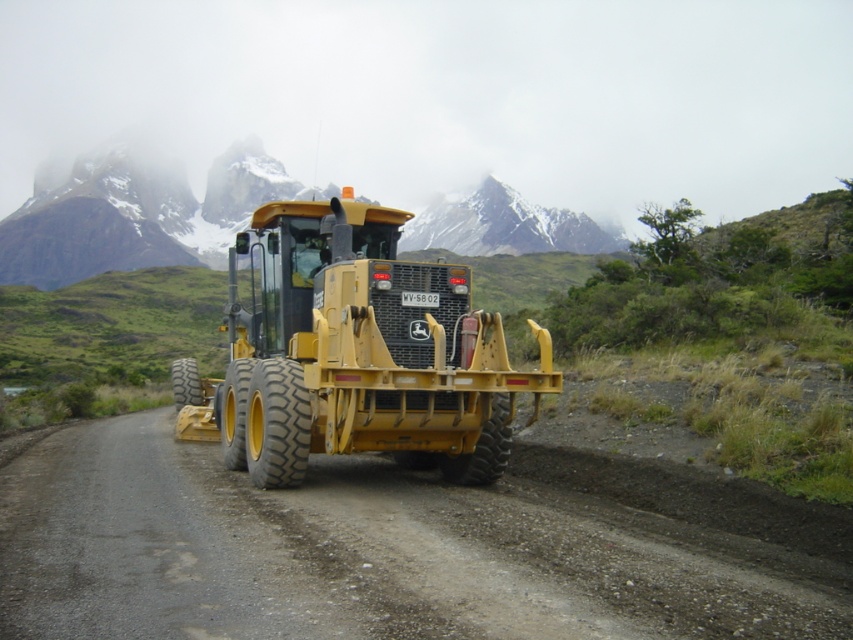
Question: Is metallic yellow tractor at center in front of snowy rocky mountain at upper center?

Choices:
 (A) no
 (B) yes

Answer: (B)

Question: Which point appears closest to the camera in this image?

Choices:
 (A) (572, 237)
 (B) (192, 428)
 (C) (395, 621)

Answer: (C)

Question: Can you confirm if dirt track at center is positioned to the left of snowy rocky mountain at upper center?

Choices:
 (A) yes
 (B) no

Answer: (B)

Question: Among these objects, which one is nearest to the camera?

Choices:
 (A) snowy rocky mountain at upper center
 (B) metallic yellow tractor at center

Answer: (B)

Question: Is metallic yellow tractor at center below snowy rocky mountain at upper center?

Choices:
 (A) no
 (B) yes

Answer: (B)

Question: Which point appears farthest from the camera in this image?

Choices:
 (A) (708, 502)
 (B) (228, 416)

Answer: (B)